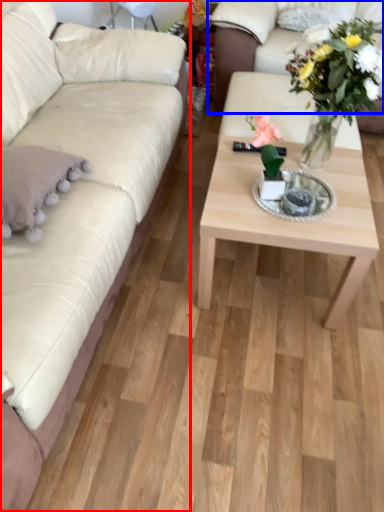
Question: Among these objects, which one is farthest to the camera, studio couch (highlighted by a red box) or studio couch (highlighted by a blue box)?

Choices:
 (A) studio couch
 (B) studio couch

Answer: (B)